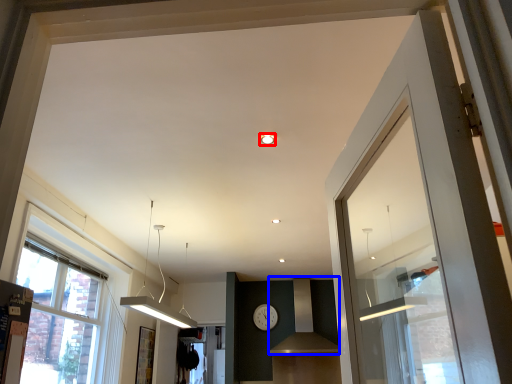
Question: Which object appears farthest to the camera in this image, lighting (highlighted by a red box) or vent (highlighted by a blue box)?

Choices:
 (A) lighting
 (B) vent

Answer: (B)